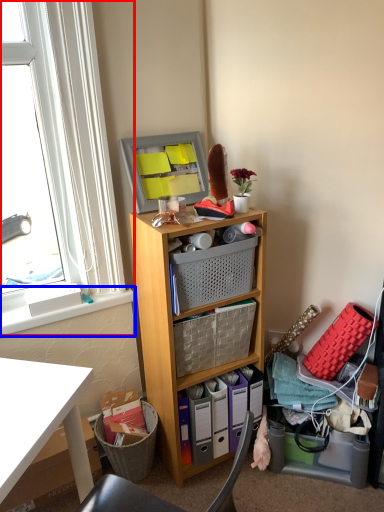
Question: Which point is further to the camera, window (highlighted by a red box) or window sill (highlighted by a blue box)?

Choices:
 (A) window
 (B) window sill

Answer: (B)